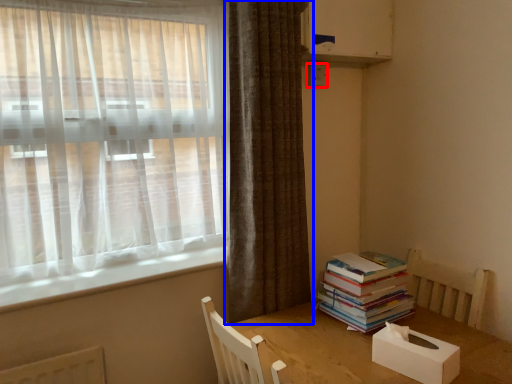
Question: Which of the following is the farthest to the observer, electric outlet (highlighted by a red box) or curtain (highlighted by a blue box)?

Choices:
 (A) electric outlet
 (B) curtain

Answer: (A)